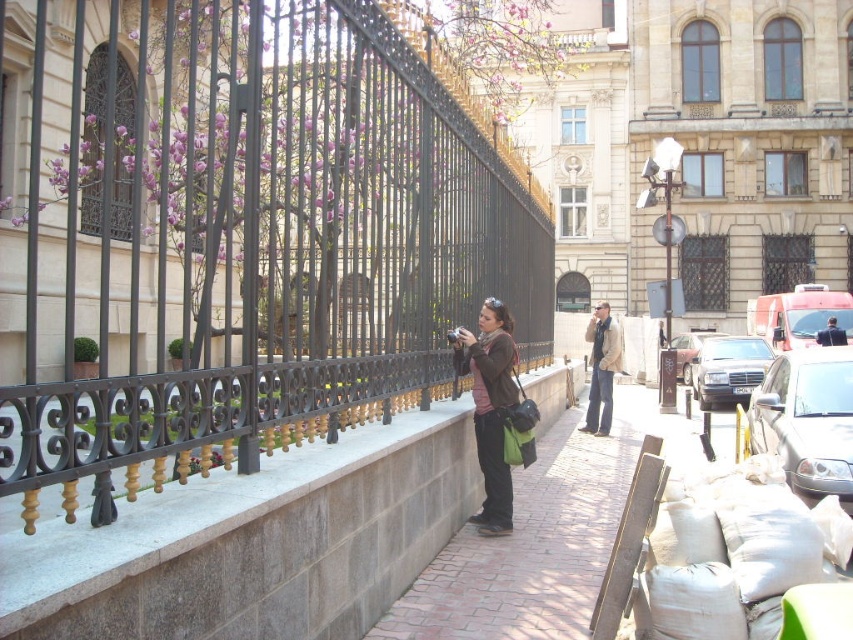
Question: Does gray stone ledge at center have a greater width compared to matte brown jacket at center?

Choices:
 (A) no
 (B) yes

Answer: (B)

Question: Does matte brown jacket at center have a smaller size compared to metallic silver sedan at center-right?

Choices:
 (A) no
 (B) yes

Answer: (B)

Question: Which of these objects is positioned closest to the brick pavement at center?

Choices:
 (A) black wrought iron fence at upper left
 (B) gray stone ledge at center
 (C) black metallic car at center
 (D) metallic silver sedan at center-right

Answer: (B)

Question: Which point is closer to the camera taking this photo?

Choices:
 (A) (491, 406)
 (B) (323, 636)

Answer: (B)

Question: From the image, what is the correct spatial relationship of brick pavement at center in relation to metallic silver car at right?

Choices:
 (A) below
 (B) above

Answer: (A)

Question: Which point is farther to the camera?

Choices:
 (A) (488, 316)
 (B) (61, 227)
 (C) (791, 435)
 (D) (566, 458)

Answer: (B)